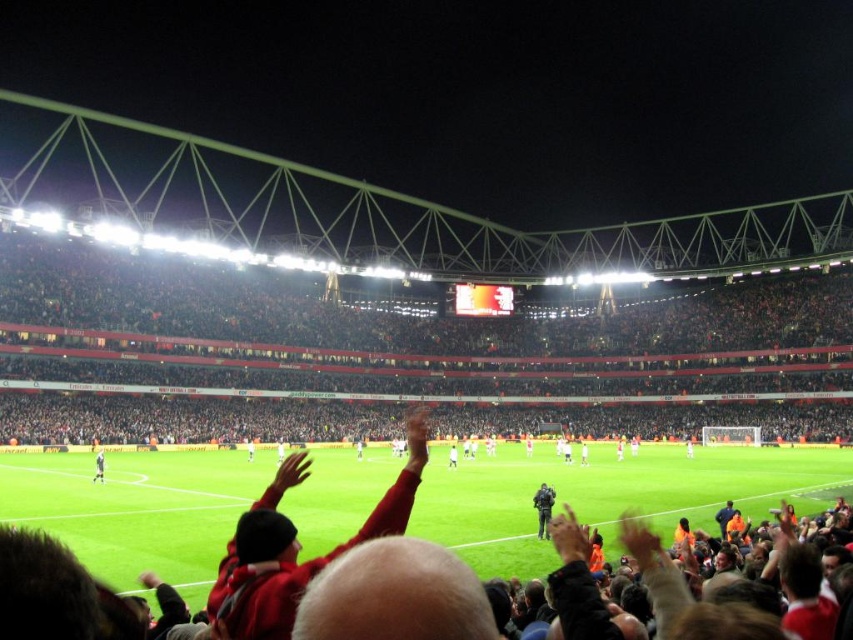
The image size is (853, 640). What do you see at coordinates (543, 508) in the screenshot?
I see `dark gray uniform at center` at bounding box center [543, 508].

Is dark gray uniform at center smaller than white jersey at center?

Correct, dark gray uniform at center occupies less space than white jersey at center.

Where is `dark gray uniform at center`? dark gray uniform at center is located at coordinates (543, 508).

You are a GUI agent. You are given a task and a screenshot of the screen. Output one action in this format:
    pyautogui.click(x=<x>, y=<y>)
    Task: Click on the dark gray uniform at center
    The width and height of the screenshot is (853, 640).
    Given the screenshot: What is the action you would take?
    pyautogui.click(x=543, y=508)

Does point (606, 332) come in front of point (102, 465)?

No, (606, 332) is further to viewer.

Is point (393, 346) positioned after point (96, 476)?

Yes.

Find the location of `dark red fabric crowd at center`. dark red fabric crowd at center is located at coordinates (399, 316).

Is dark red fabric crowd at center wider than dark gray uniform at center?

Yes.

Is dark red fabric crowd at center bigger than dark gray uniform at center?

Yes, dark red fabric crowd at center is bigger than dark gray uniform at center.

The height and width of the screenshot is (640, 853). Identify the location of dark red fabric crowd at center. pos(399,316).